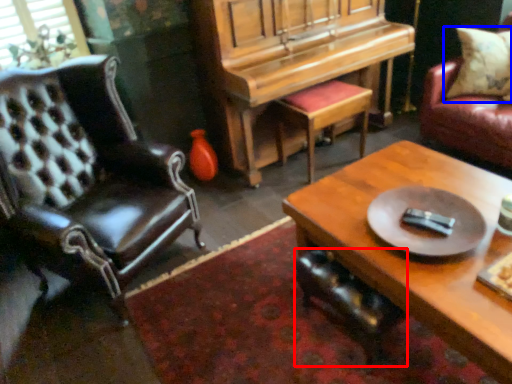
Question: Which object appears farthest to the camera in this image, chair (highlighted by a red box) or pillow (highlighted by a blue box)?

Choices:
 (A) chair
 (B) pillow

Answer: (B)